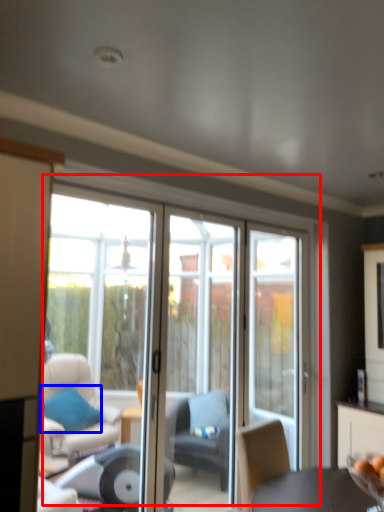
Question: Which object is closer to the camera taking this photo, door (highlighted by a red box) or pillow (highlighted by a blue box)?

Choices:
 (A) door
 (B) pillow

Answer: (A)